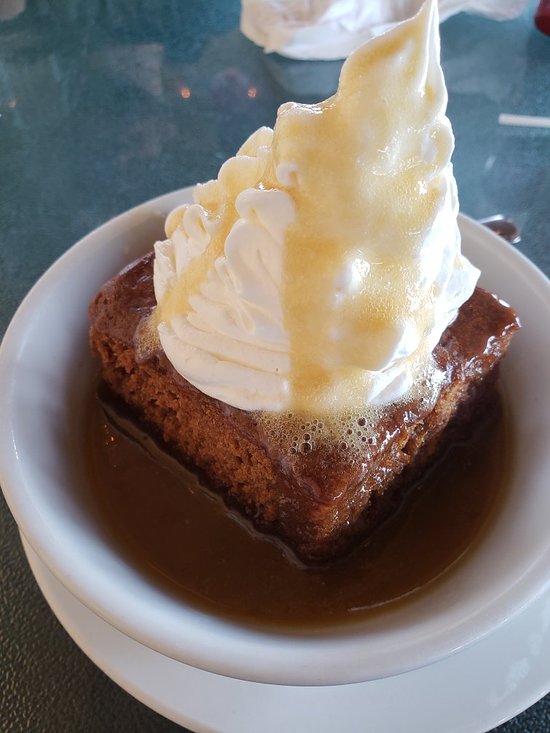
Image resolution: width=550 pixels, height=733 pixels. What are the coordinates of `sauce plate` in the screenshot? It's located at (478, 698).